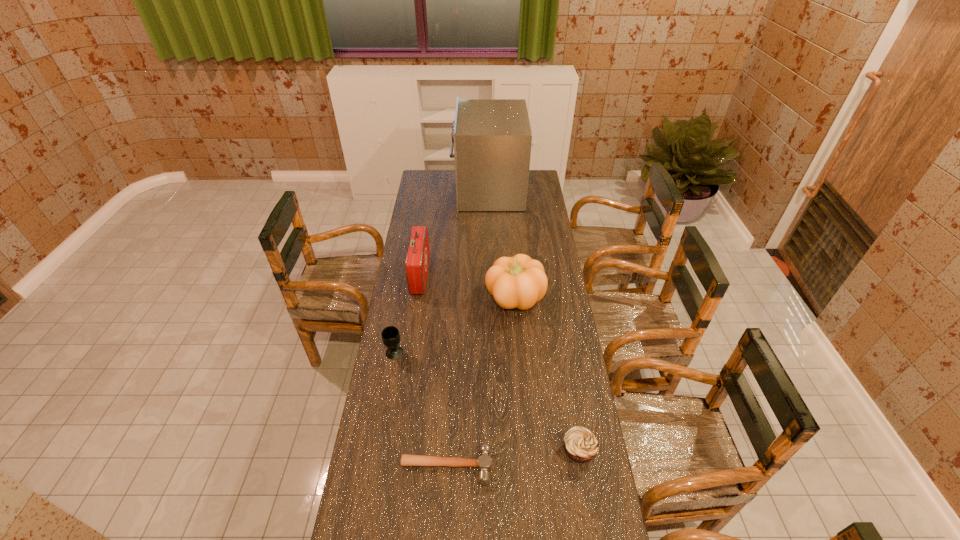
I want to click on free space between the pumpkin and the shortest object, so click(481, 381).

Locate an element on the screen. This screenshot has width=960, height=540. empty location between the chalice and the muffin is located at coordinates (487, 402).

Locate an element on the screen. This screenshot has height=540, width=960. empty location between the pumpkin and the hammer is located at coordinates (481, 381).

The width and height of the screenshot is (960, 540). Identify the location of free point between the muffin and the shortest object. (513, 458).

I want to click on empty location between the muffin and the shortest object, so click(513, 458).

Where is `vacant area between the pumpkin and the second shortest object`? This screenshot has width=960, height=540. vacant area between the pumpkin and the second shortest object is located at coordinates (547, 374).

The width and height of the screenshot is (960, 540). What are the coordinates of `free space between the hammer and the pumpkin` in the screenshot? It's located at (481, 381).

I want to click on object that stands as the third closest to the third shortest object, so click(519, 282).

Locate which object ranks third in proximity to the third nearest object. Please provide its 2D coordinates. Your answer should be formatted as a tuple, i.e. [(x, y)], where the tuple contains the x and y coordinates of a point satisfying the conditions above.

[(519, 282)]

Where is `free space that satisfies the following two spatial constraints: 1. on the front panel of the farthest object; 2. on the front side of the hammer`? free space that satisfies the following two spatial constraints: 1. on the front panel of the farthest object; 2. on the front side of the hammer is located at coordinates (495, 466).